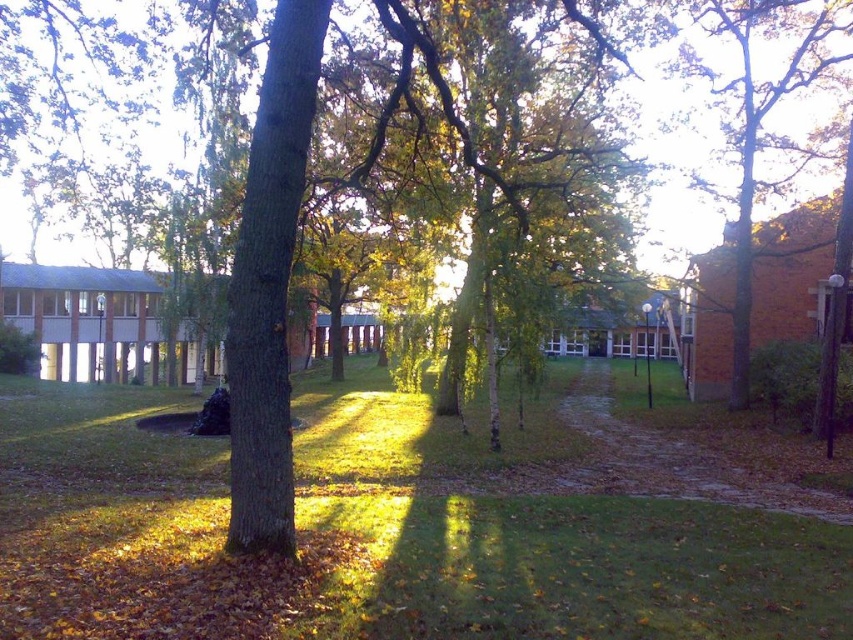
Question: Considering the relative positions of green grass at center and brown textured tree at right in the image provided, where is green grass at center located with respect to brown textured tree at right?

Choices:
 (A) left
 (B) right

Answer: (A)

Question: Among these points, which one is farthest from the camera?

Choices:
 (A) (123, 548)
 (B) (809, 45)

Answer: (B)

Question: Is green grass at center bigger than brown textured tree at right?

Choices:
 (A) yes
 (B) no

Answer: (B)

Question: Does green grass at center have a larger size compared to brown textured tree at right?

Choices:
 (A) no
 (B) yes

Answer: (A)

Question: Which point appears farthest from the camera in this image?

Choices:
 (A) (509, 504)
 (B) (746, 202)

Answer: (B)